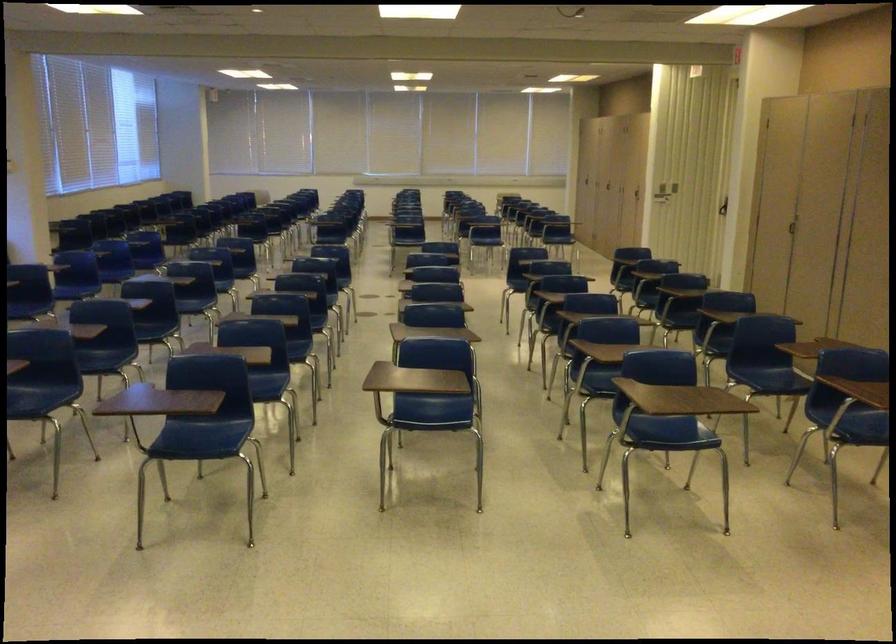
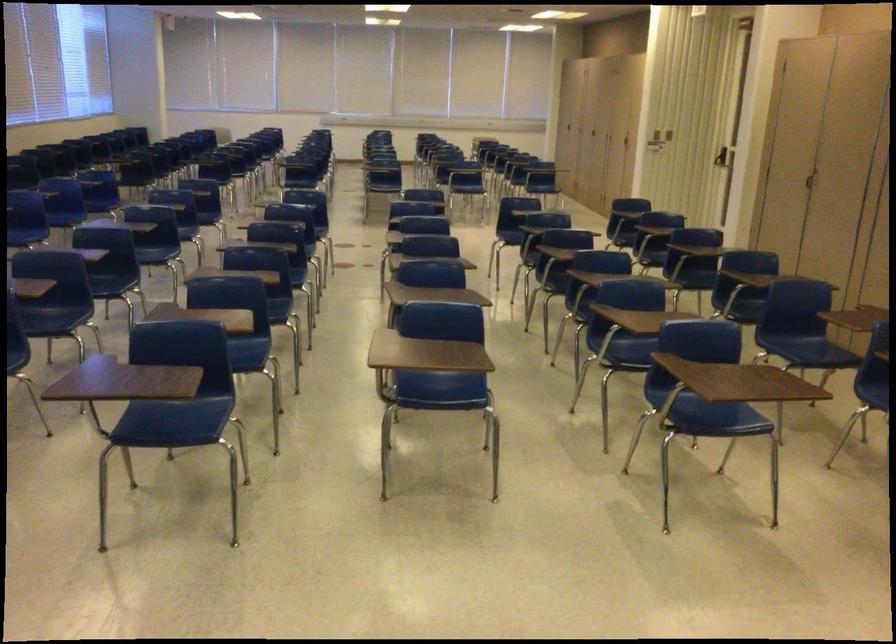
Question: How did the camera likely rotate?

Choices:
 (A) Left
 (B) Right
 (C) Up
 (D) Down

Answer: (D)